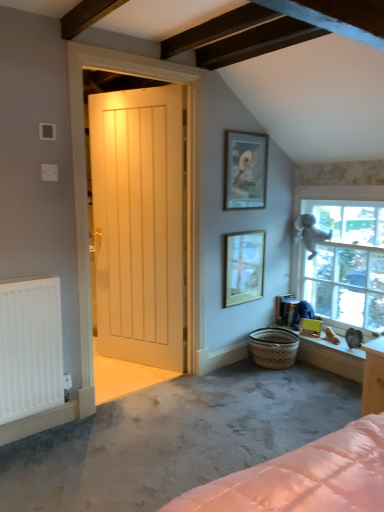
Question: Based on their positions, is white matte radiator at lower left located to the left or right of white wooden door at center?

Choices:
 (A) right
 (B) left

Answer: (B)

Question: Is white matte radiator at lower left taller or shorter than white wooden door at center?

Choices:
 (A) tall
 (B) short

Answer: (B)

Question: Estimate the real-world distances between objects in this image. Which object is farther from the woven natural basket at lower right?

Choices:
 (A) smooth white window sill at lower right
 (B) clear glass window at upper right
 (C) gray carpet at lower left
 (D) white wooden door at center
 (E) matte glass picture frame at center, which ranks as the second picture frame in bottom-to-top order

Answer: (D)

Question: Estimate the real-world distances between objects in this image. Which object is closer to the green matte picture frame at lower right, which ranks as the 3th picture frame in left-to-right order?

Choices:
 (A) white matte radiator at lower left
 (B) gray carpet at lower left
 (C) matte wooden picture frame at upper center, the 1th picture frame from the top
 (D) clear glass window at upper right
 (E) woven natural basket at lower right

Answer: (E)